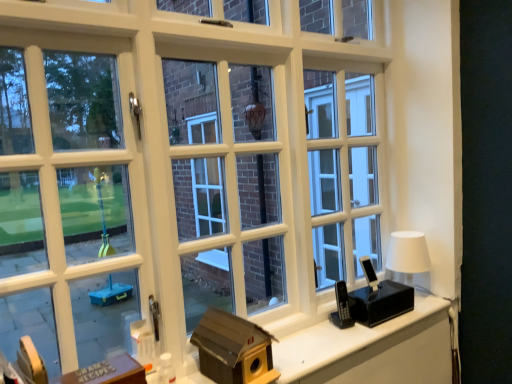
Question: From a real-world perspective, is metallic silver buttons at lower left located higher than wooden birdhouse at lower right?

Choices:
 (A) no
 (B) yes

Answer: (B)

Question: Is metallic silver buttons at lower left placed right next to wooden birdhouse at lower right?

Choices:
 (A) yes
 (B) no

Answer: (B)

Question: Does metallic silver buttons at lower left have a lesser height compared to wooden birdhouse at lower right?

Choices:
 (A) yes
 (B) no

Answer: (B)

Question: Are metallic silver buttons at lower left and wooden birdhouse at lower right far apart?

Choices:
 (A) no
 (B) yes

Answer: (A)

Question: Is metallic silver buttons at lower left outside wooden birdhouse at lower right?

Choices:
 (A) yes
 (B) no

Answer: (A)

Question: Based on their sizes in the image, would you say brown cardboard birdhouse at center is bigger or smaller than white matte table lamp at right?

Choices:
 (A) big
 (B) small

Answer: (A)

Question: Does point (258, 329) appear closer or farther from the camera than point (390, 238)?

Choices:
 (A) closer
 (B) farther

Answer: (A)

Question: From the image's perspective, is brown cardboard birdhouse at center located above or below white matte table lamp at right?

Choices:
 (A) below
 (B) above

Answer: (A)

Question: From a real-world perspective, is brown cardboard birdhouse at center above or below white matte table lamp at right?

Choices:
 (A) above
 (B) below

Answer: (B)

Question: In terms of width, does brown cardboard birdhouse at center look wider or thinner when compared to metallic silver buttons at lower left?

Choices:
 (A) thin
 (B) wide

Answer: (B)

Question: From the image's perspective, is brown cardboard birdhouse at center positioned above or below metallic silver buttons at lower left?

Choices:
 (A) below
 (B) above

Answer: (B)

Question: From a real-world perspective, is brown cardboard birdhouse at center above or below metallic silver buttons at lower left?

Choices:
 (A) below
 (B) above

Answer: (B)

Question: Is brown cardboard birdhouse at center bigger or smaller than metallic silver buttons at lower left?

Choices:
 (A) small
 (B) big

Answer: (B)

Question: Considering the positions of point (360, 350) and point (416, 244), is point (360, 350) closer or farther from the camera than point (416, 244)?

Choices:
 (A) farther
 (B) closer

Answer: (B)

Question: Is wooden birdhouse at lower right taller or shorter than white matte table lamp at right?

Choices:
 (A) tall
 (B) short

Answer: (B)